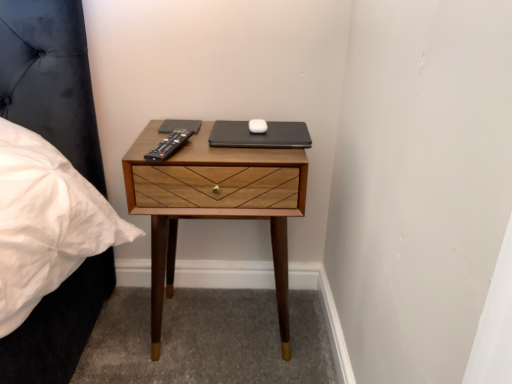
Question: Based on their sizes in the image, would you say black plastic remote at center is bigger or smaller than wooden nightstand at center?

Choices:
 (A) big
 (B) small

Answer: (B)

Question: Considering the positions of black plastic remote at center and wooden nightstand at center in the image, is black plastic remote at center wider or thinner than wooden nightstand at center?

Choices:
 (A) wide
 (B) thin

Answer: (B)

Question: Which of these objects is positioned farthest from the black matte laptop at center?

Choices:
 (A) black plastic remote at center
 (B) wooden nightstand at center

Answer: (B)

Question: Which is farther from the wooden nightstand at center?

Choices:
 (A) black matte laptop at center
 (B) black plastic remote at center

Answer: (B)